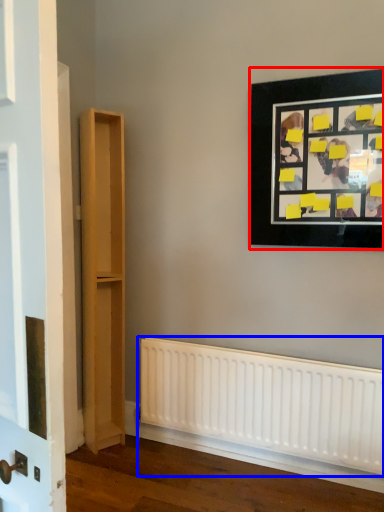
Question: Among these objects, which one is farthest to the camera, picture frame (highlighted by a red box) or radiator (highlighted by a blue box)?

Choices:
 (A) picture frame
 (B) radiator

Answer: (B)